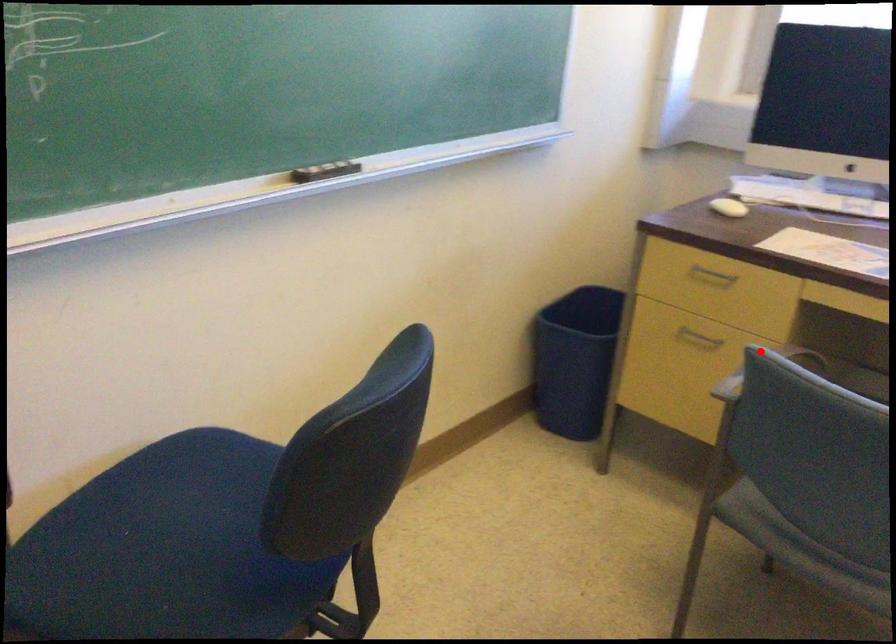
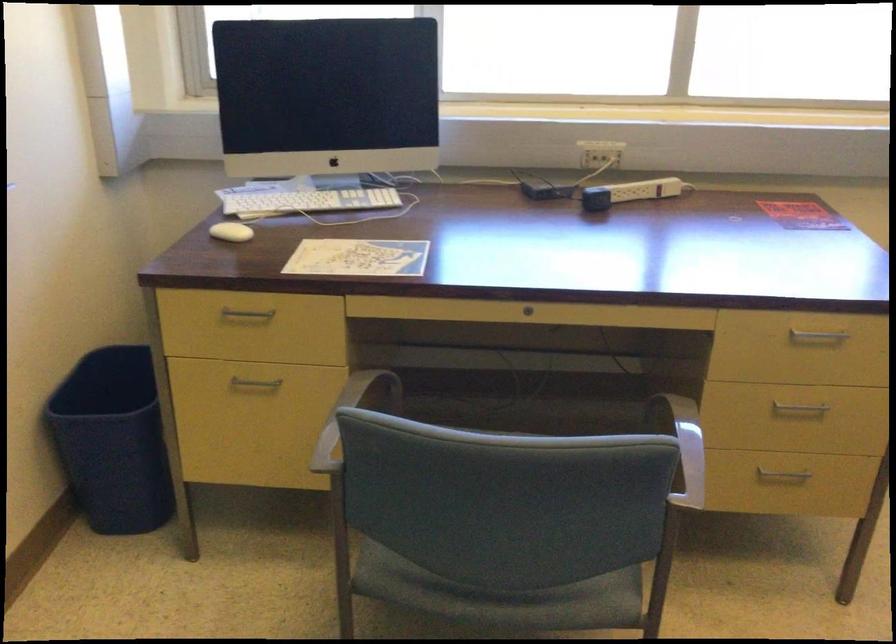
Find the pixel in the second image that matches the highlighted location in the first image.

(350, 415)